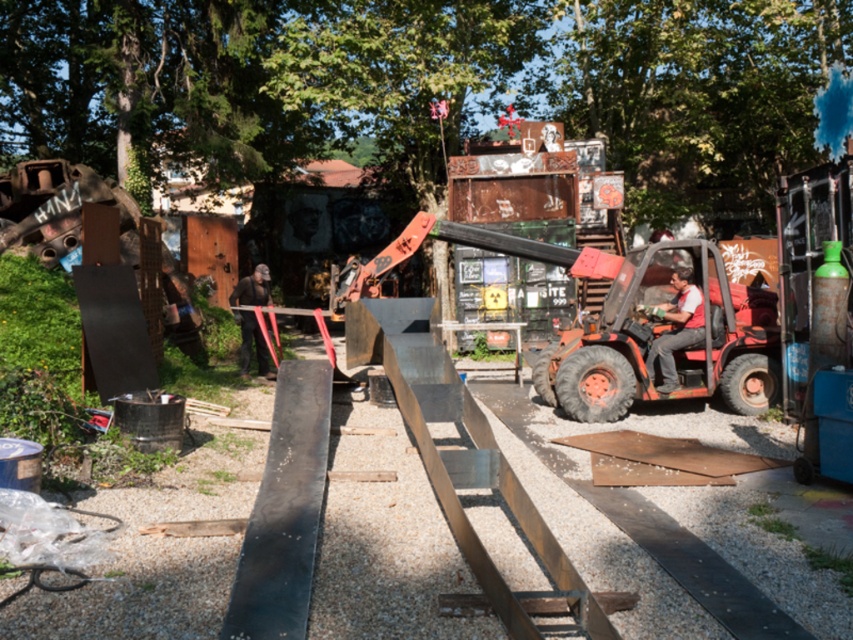
You are standing in the workshop and need to move a heavy object from point A to point B. Point A is at coordinate point (x=689, y=342) and point B is at coordinate point (x=260, y=288). Which point is closer to you where you are standing?

Point A at coordinate point (x=689, y=342) is closer to you than point B at coordinate point (x=260, y=288).